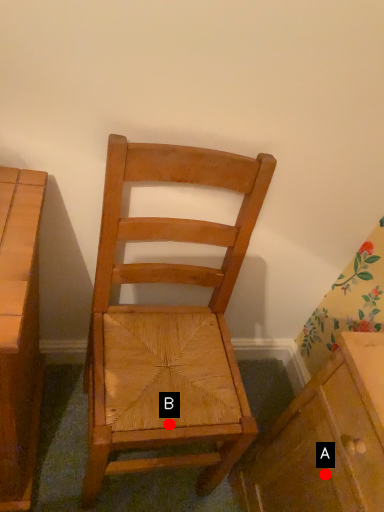
Question: Two points are circled on the image, labeled by A and B beside each circle. Which point is farther from the camera taking this photo?

Choices:
 (A) A is further
 (B) B is further

Answer: (B)